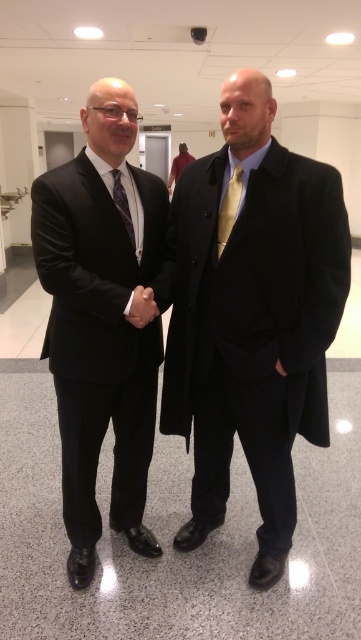
Who is lower down, matte black suit at left or matte black tie at center?

Positioned lower is matte black suit at left.

Can you confirm if matte black suit at left is wider than matte black tie at center?

Yes, matte black suit at left is wider than matte black tie at center.

What do you see at coordinates (101, 321) in the screenshot?
I see `matte black suit at left` at bounding box center [101, 321].

Locate an element on the screen. matte black suit at left is located at coordinates (101, 321).

Between point (263, 502) and point (103, 180), which one is positioned behind?

The point (263, 502) is more distant.

Locate an element on the screen. This screenshot has height=640, width=361. matte black coat at center is located at coordinates (251, 317).

Who is more distant from viewer, (210, 378) or (50, 352)?

Point (210, 378)

Where is `matte black coat at center`? This screenshot has height=640, width=361. matte black coat at center is located at coordinates (251, 317).

Can you confirm if matte black hand at center is positioned to the left of matte black tie at center?

In fact, matte black hand at center is to the right of matte black tie at center.

Who is taller, matte black hand at center or matte black tie at center?

matte black tie at center

Is point (138, 316) more distant than point (122, 195)?

That is False.

Locate an element on the screen. The image size is (361, 640). matte black hand at center is located at coordinates (141, 307).